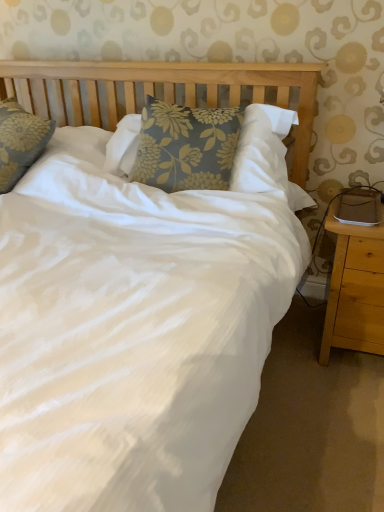
This screenshot has width=384, height=512. Describe the element at coordinates (355, 289) in the screenshot. I see `light brown wood nightstand at lower right` at that location.

The width and height of the screenshot is (384, 512). Find the location of `light brown wood nightstand at lower right`. light brown wood nightstand at lower right is located at coordinates (355, 289).

Locate an element on the screen. blue floral pillow at center is located at coordinates (186, 146).

Describe the element at coordinates (186, 146) in the screenshot. I see `blue floral pillow at center` at that location.

Identify the location of light brown wood nightstand at lower right. (355, 289).

Does blue floral pillow at center appear on the left side of light brown wood nightstand at lower right?

Indeed, blue floral pillow at center is positioned on the left side of light brown wood nightstand at lower right.

Which object is more forward, blue floral pillow at center or light brown wood nightstand at lower right?

light brown wood nightstand at lower right is closer to the camera.

Is point (186, 130) positioned in front of point (361, 293)?

No.

From the image's perspective, relative to light brown wood nightstand at lower right, is blue floral pillow at center above or below?

Based on their image positions, blue floral pillow at center is located above light brown wood nightstand at lower right.

From a real-world perspective, is blue floral pillow at center over light brown wood nightstand at lower right?

Correct, in the physical world, blue floral pillow at center is higher than light brown wood nightstand at lower right.

Can you confirm if blue floral pillow at center is wider than light brown wood nightstand at lower right?

In fact, blue floral pillow at center might be narrower than light brown wood nightstand at lower right.

Does blue floral pillow at center have a lesser height compared to light brown wood nightstand at lower right?

Correct, blue floral pillow at center is not as tall as light brown wood nightstand at lower right.

Which of these two, blue floral pillow at center or light brown wood nightstand at lower right, is smaller?

Smaller between the two is light brown wood nightstand at lower right.

Is light brown wood nightstand at lower right inside blue floral pillow at center?

That's incorrect, light brown wood nightstand at lower right is not inside blue floral pillow at center.

Does blue floral pillow at center touch light brown wood nightstand at lower right?

They are not placed beside each other.

Is blue floral pillow at center looking in the opposite direction of light brown wood nightstand at lower right?

No, blue floral pillow at center is not facing away from light brown wood nightstand at lower right.

How many degrees apart are the facing directions of blue floral pillow at center and light brown wood nightstand at lower right?

9.56 degrees.

How distant is blue floral pillow at center from light brown wood nightstand at lower right?

blue floral pillow at center and light brown wood nightstand at lower right are 23.86 inches apart from each other.

At what (x,y) coordinates should I click in order to perform the action: click on pillow on the left of light brown wood nightstand at lower right. Please return your answer as a coordinate pair (x, y). The height and width of the screenshot is (512, 384). Looking at the image, I should click on (186, 146).

Which is more to the right, light brown wood nightstand at lower right or blue floral pillow at center?

From the viewer's perspective, light brown wood nightstand at lower right appears more on the right side.

Relative to blue floral pillow at center, is light brown wood nightstand at lower right in front or behind?

light brown wood nightstand at lower right is positioned closer to the viewer than blue floral pillow at center.

Is point (367, 249) closer to camera compared to point (202, 120)?

Yes, it is.

From the image's perspective, which object appears higher, light brown wood nightstand at lower right or blue floral pillow at center?

blue floral pillow at center appears higher in the image.

From a real-world perspective, who is located lower, light brown wood nightstand at lower right or blue floral pillow at center?

In real-world perspective, light brown wood nightstand at lower right is lower.

In the scene shown: Between light brown wood nightstand at lower right and blue floral pillow at center, which one has smaller width?

blue floral pillow at center.

Between light brown wood nightstand at lower right and blue floral pillow at center, which one has more height?

With more height is light brown wood nightstand at lower right.

Who is bigger, light brown wood nightstand at lower right or blue floral pillow at center?

With larger size is blue floral pillow at center.

Does light brown wood nightstand at lower right contain blue floral pillow at center?

No, blue floral pillow at center is not surrounded by light brown wood nightstand at lower right.

Can you see light brown wood nightstand at lower right touching blue floral pillow at center?

No, light brown wood nightstand at lower right is not with blue floral pillow at center.

Could you tell me if light brown wood nightstand at lower right is turned towards blue floral pillow at center?

No, light brown wood nightstand at lower right is not aimed at blue floral pillow at center.

How different are the orientations of light brown wood nightstand at lower right and blue floral pillow at center in degrees?

9.56 degrees.

This screenshot has height=512, width=384. In order to click on pillow above the light brown wood nightstand at lower right (from the image's perspective) in this screenshot , I will do `click(186, 146)`.

The image size is (384, 512). What are the coordinates of `pillow behind the light brown wood nightstand at lower right` in the screenshot? It's located at (186, 146).

At what (x,y) coordinates should I click in order to perform the action: click on pillow lying above the light brown wood nightstand at lower right (from the image's perspective). Please return your answer as a coordinate pair (x, y). This screenshot has width=384, height=512. Looking at the image, I should click on (186, 146).